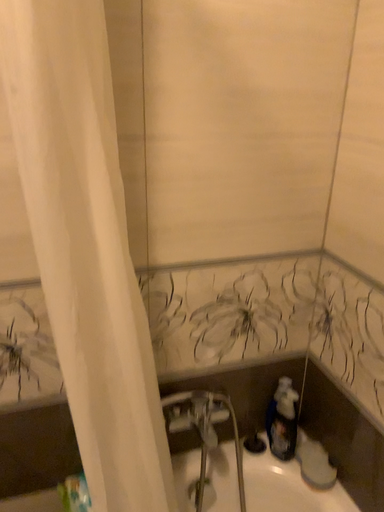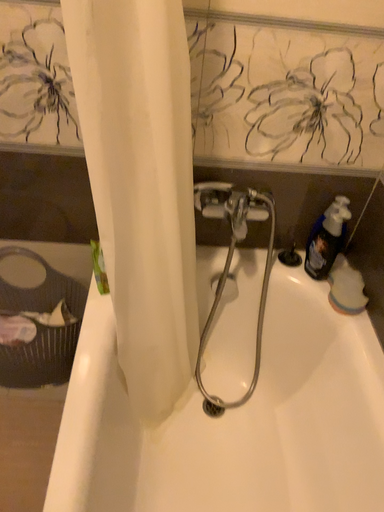
Question: How did the camera likely rotate when shooting the video?

Choices:
 (A) rotated downward
 (B) rotated upward

Answer: (A)